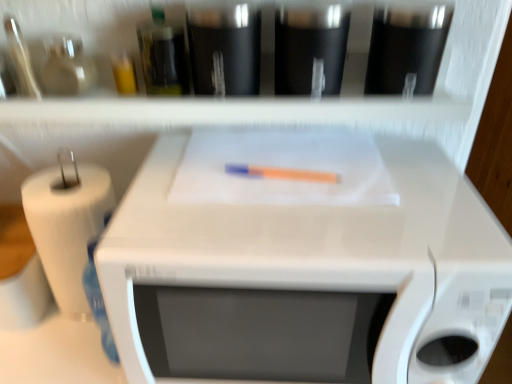
Question: Is white glossy microwave at center at the left side of white matte shelf at upper center?

Choices:
 (A) yes
 (B) no

Answer: (B)

Question: Considering the relative sizes of white glossy microwave at center and white matte shelf at upper center in the image provided, is white glossy microwave at center wider than white matte shelf at upper center?

Choices:
 (A) no
 (B) yes

Answer: (B)

Question: Can you confirm if white glossy microwave at center is positioned to the right of white matte shelf at upper center?

Choices:
 (A) yes
 (B) no

Answer: (A)

Question: Would you say white glossy microwave at center is outside white matte shelf at upper center?

Choices:
 (A) no
 (B) yes

Answer: (B)

Question: From a real-world perspective, is white glossy microwave at center beneath white matte shelf at upper center?

Choices:
 (A) yes
 (B) no

Answer: (A)

Question: From a real-world perspective, relative to white paper at left, is white glossy microwave at center vertically above or below?

Choices:
 (A) below
 (B) above

Answer: (B)

Question: In terms of size, does white glossy microwave at center appear bigger or smaller than white paper at left?

Choices:
 (A) big
 (B) small

Answer: (A)

Question: Considering the positions of point (139, 225) and point (52, 271), is point (139, 225) closer or farther from the camera than point (52, 271)?

Choices:
 (A) farther
 (B) closer

Answer: (B)

Question: Considering their positions, is white glossy microwave at center located in front of or behind white paper at left?

Choices:
 (A) front
 (B) behind

Answer: (A)

Question: Would you say white paper at left is to the left or to the right of orange matte crayon at center in the picture?

Choices:
 (A) right
 (B) left

Answer: (B)

Question: From the image's perspective, is white paper at left positioned above or below orange matte crayon at center?

Choices:
 (A) above
 (B) below

Answer: (B)

Question: Which is correct: white paper at left is inside orange matte crayon at center, or outside of it?

Choices:
 (A) inside
 (B) outside

Answer: (B)

Question: From a real-world perspective, is white paper at left physically located above or below orange matte crayon at center?

Choices:
 (A) below
 (B) above

Answer: (A)

Question: In terms of size, does white paper at left appear bigger or smaller than white glossy microwave at center?

Choices:
 (A) big
 (B) small

Answer: (B)

Question: Is white paper at left taller or shorter than white glossy microwave at center?

Choices:
 (A) short
 (B) tall

Answer: (A)